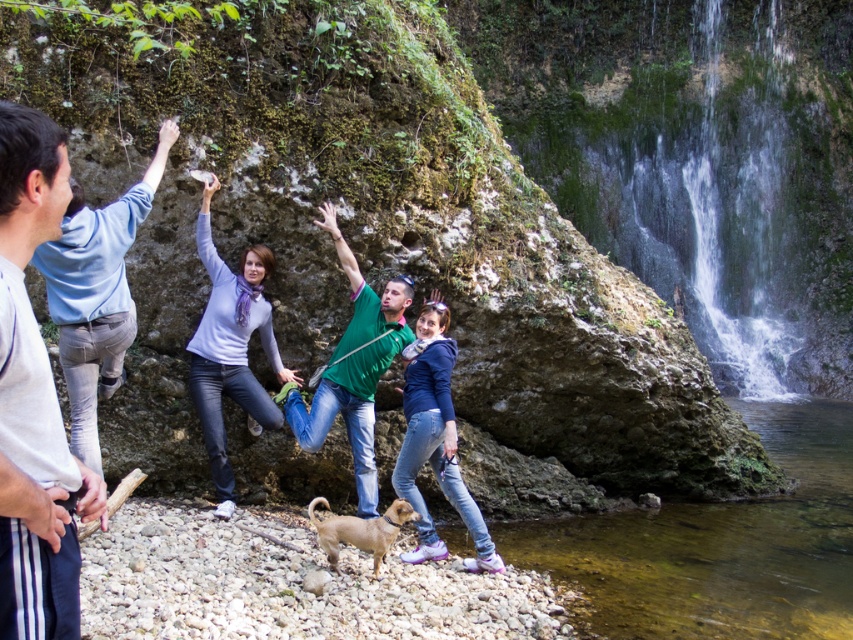
Question: Among these points, which one is nearest to the camera?

Choices:
 (A) (810, 486)
 (B) (80, 349)
 (C) (387, 538)

Answer: (C)

Question: Which point is farther to the camera?

Choices:
 (A) green matte shirt at center
 (B) blue denim jeans at center

Answer: (A)

Question: Does green mossy rock at upper right appear on the right side of light blue jeans at left?

Choices:
 (A) no
 (B) yes

Answer: (B)

Question: Which object appears farthest from the camera in this image?

Choices:
 (A) green matte shirt at center
 (B) light blue jeans at left

Answer: (A)

Question: Does matte purple sweater at center have a greater width compared to brown furry dog at lower center?

Choices:
 (A) no
 (B) yes

Answer: (B)

Question: Is green mossy rock at upper right to the left of blue denim jeans at center from the viewer's perspective?

Choices:
 (A) yes
 (B) no

Answer: (B)